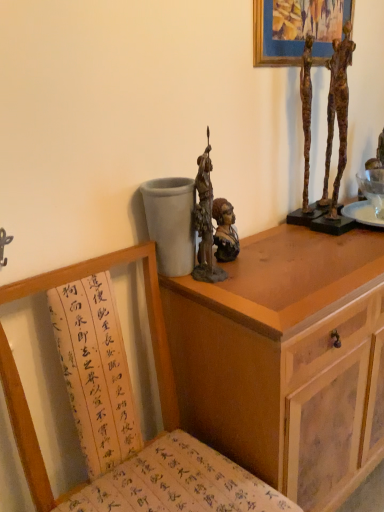
Locate an element on the screen. free spot to the right of bronze bust at center, the first person positioned from the left is located at coordinates (290, 251).